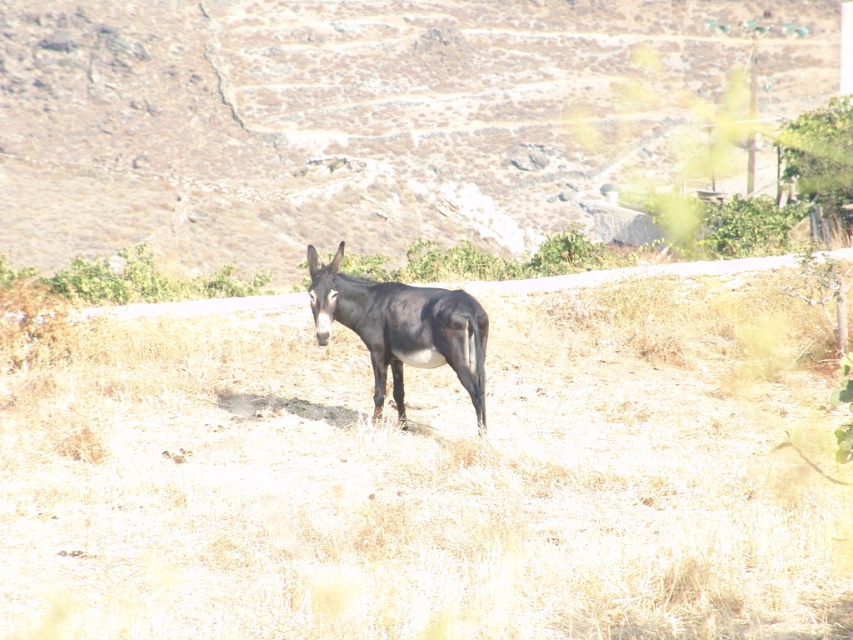
Describe the element at coordinates (434, 477) in the screenshot. The width and height of the screenshot is (853, 640). I see `dry grass at center` at that location.

Does dry grass at center lie behind dark brown fur at center?

No, it is not.

Does point (296, 420) come farther from viewer compared to point (308, 260)?

That is True.

Image resolution: width=853 pixels, height=640 pixels. Identify the location of dry grass at center. (434, 477).

How much distance is there between dry grass at center and brown rough donkey at center?

They are 61.07 feet apart.

Can you confirm if dry grass at center is bigger than brown rough donkey at center?

Incorrect, dry grass at center is not larger than brown rough donkey at center.

Locate an element on the screen. dry grass at center is located at coordinates (434, 477).

Find the location of a particular element. The height and width of the screenshot is (640, 853). dry grass at center is located at coordinates (434, 477).

Is brown rough donkey at center shorter than dark brown fur at center?

Incorrect, brown rough donkey at center's height does not fall short of dark brown fur at center's.

Measure the distance between brown rough donkey at center and dark brown fur at center.

A distance of 22.03 meters exists between brown rough donkey at center and dark brown fur at center.

Describe the element at coordinates (357, 116) in the screenshot. I see `brown rough donkey at center` at that location.

I want to click on brown rough donkey at center, so click(357, 116).